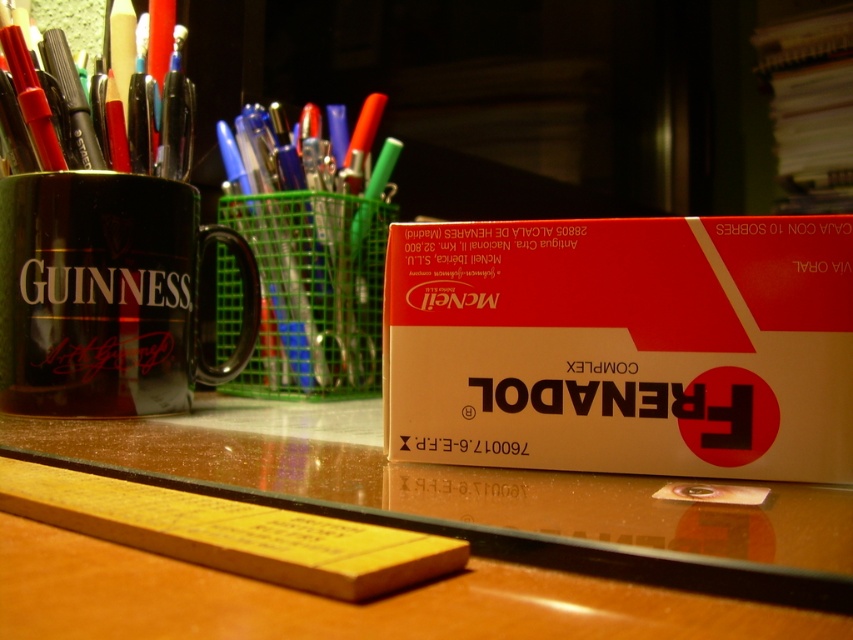
Is point (635, 269) closer to camera compared to point (25, 118)?

That is True.

Is matte cardboard box at center smaller than matte black pen at left?

Yes.

Is point (606, 221) positioned before point (119, 161)?

Yes, point (606, 221) is closer to viewer.

The width and height of the screenshot is (853, 640). Find the location of `matte cardboard box at center`. matte cardboard box at center is located at coordinates (622, 346).

Can you confirm if matte cardboard box at center is wider than matte black mug at left?

Indeed, matte cardboard box at center has a greater width compared to matte black mug at left.

Is matte cardboard box at center to the right of matte black mug at left from the viewer's perspective?

Yes, matte cardboard box at center is to the right of matte black mug at left.

Which is behind, point (718, 224) or point (221, 240)?

The point (221, 240) is behind.

Find the location of a particular element. The image size is (853, 640). matte cardboard box at center is located at coordinates (622, 346).

Between brown wooden table at center and matte black mug at left, which one is positioned lower?

brown wooden table at center

Consider the image. Measure the distance from brown wooden table at center to matte black mug at left.

The distance of brown wooden table at center from matte black mug at left is 8.55 inches.

Is point (677, 500) more distant than point (86, 376)?

No, it is in front of (86, 376).

You are a GUI agent. You are given a task and a screenshot of the screen. Output one action in this format:
    pyautogui.click(x=<x>, y=<y>)
    Task: Click on the brown wooden table at center
    This screenshot has width=853, height=640.
    Given the screenshot: What is the action you would take?
    pyautogui.click(x=489, y=522)